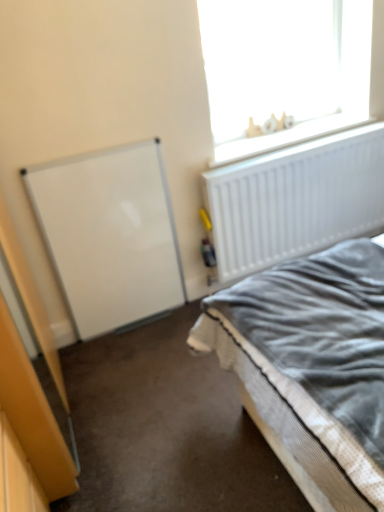
Locate an element on the screen. This screenshot has height=512, width=384. vacant space situated above white plastic letters at upper right (from a real-world perspective) is located at coordinates (275, 135).